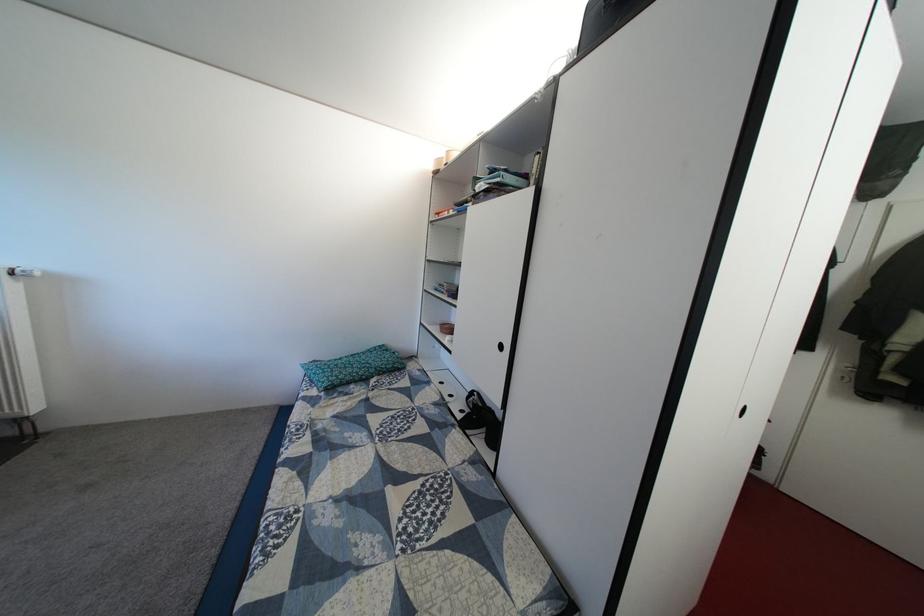
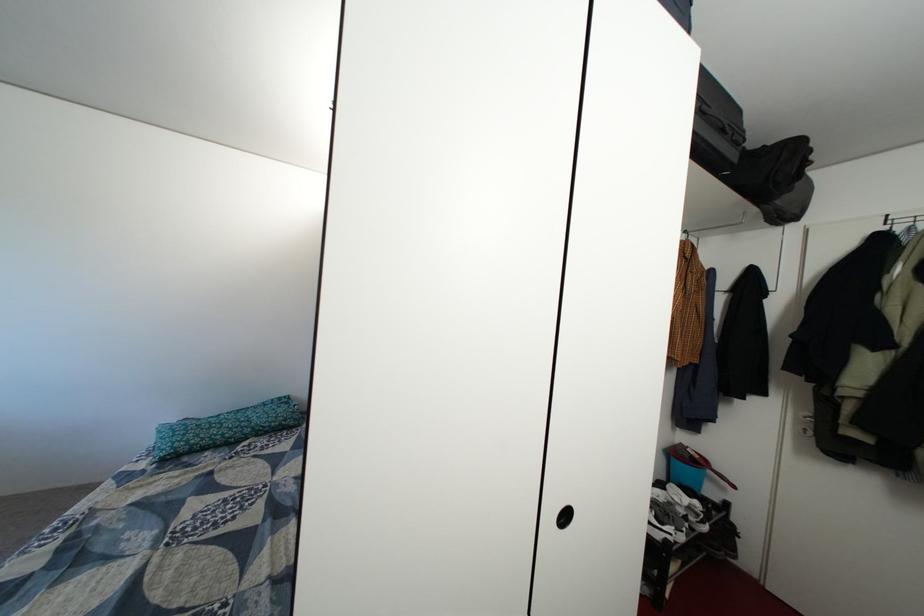
Question: In a continuous first-person perspective shot, in which direction is the camera moving?

Choices:
 (A) Left
 (B) Right
 (C) Forward
 (D) Backward

Answer: (B)